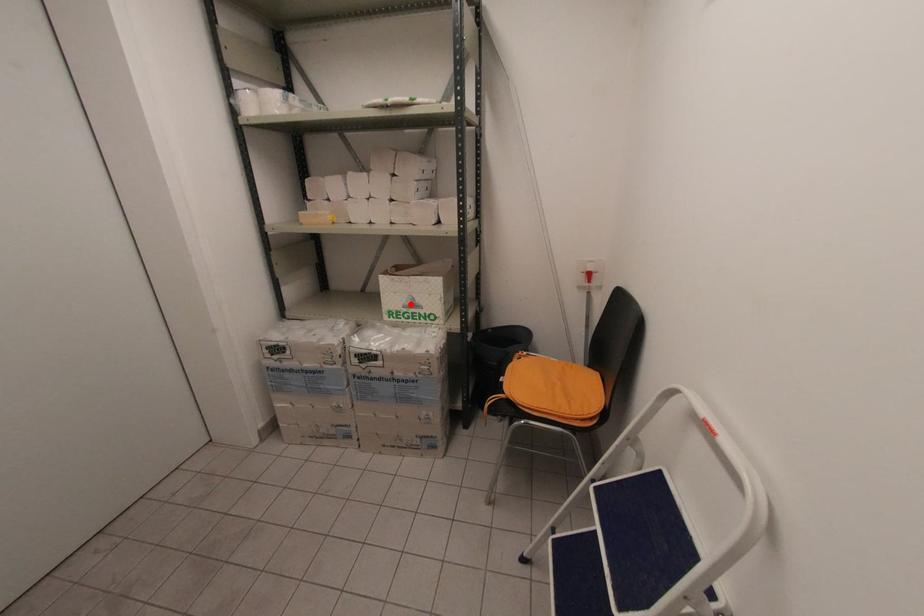
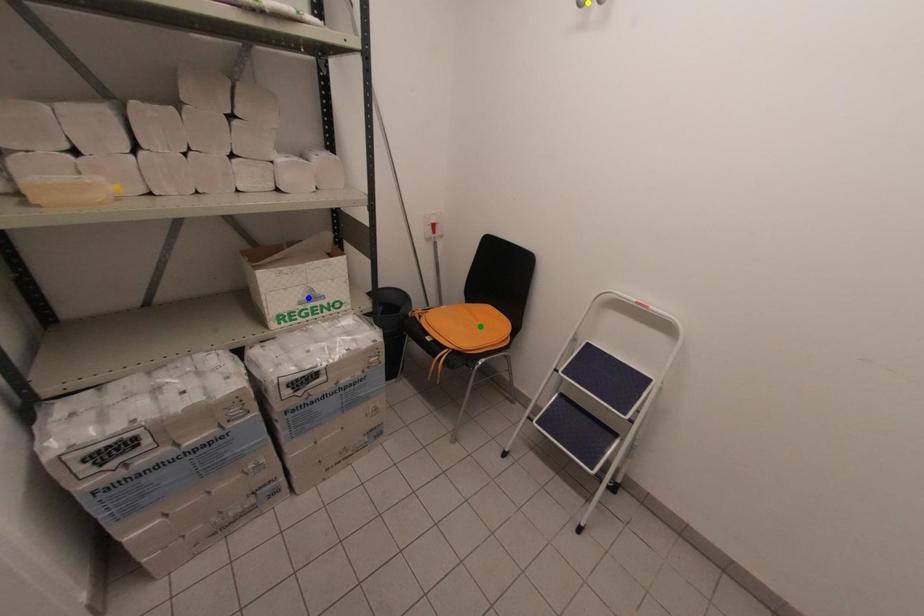
Question: I am providing you with two images of the same scene from different viewpoints. A red point is marked on the first image. You are given multiple points on the second image. Which point in image 2 represents the same 3d spot as the red point in image 1?

Choices:
 (A) blue point
 (B) green point
 (C) yellow point

Answer: (A)